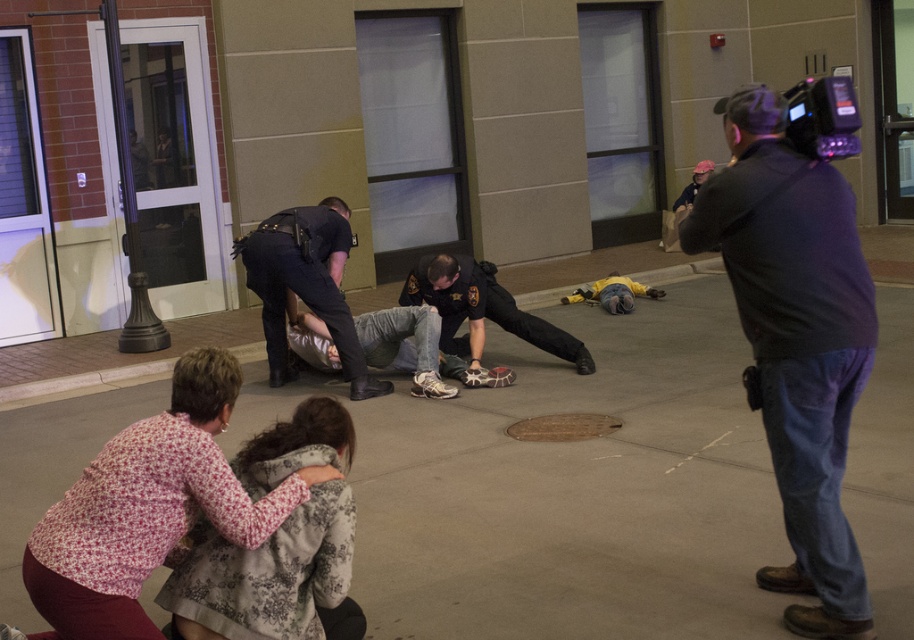
You are a photographer trying to capture a clear shot of the scene. You have a camera with a 50mm lens. The floral print blouse at lower left and the black plastic video camera at upper right are both in your frame. If you want to ensure both objects are in focus, which one should you focus on first, considering their relative sizes in the frame?

The floral print blouse at lower left might be wider than the black plastic video camera at upper right, so you should focus on the larger object first to ensure depth of field covers both.

You are a security guard who needs to monitor the scene. From your vantage point, can you see the dark uniform pants at center through the black plastic video camera at upper right?

The dark uniform pants at center is positioned under the black plastic video camera at upper right, so yes, the security guard can see the dark uniform pants at center through the black plastic video camera at upper right.

You are a delivery person trying to navigate through the area shown in the image. There is a point marked at coordinates (482, 307) which corresponds to dark uniform pants at center. Can you safely walk around this point without stepping on it?

The point at coordinates (482, 307) indicates dark uniform pants at center, so yes, you can safely walk around this point as long as you avoid stepping directly on the dark uniform pants at center.